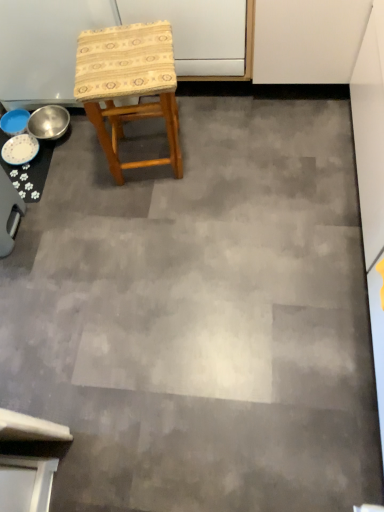
Locate an element on the screen. vacant area that lies between blue glossy bowls at left and metallic silver bowl at left is located at coordinates (61, 164).